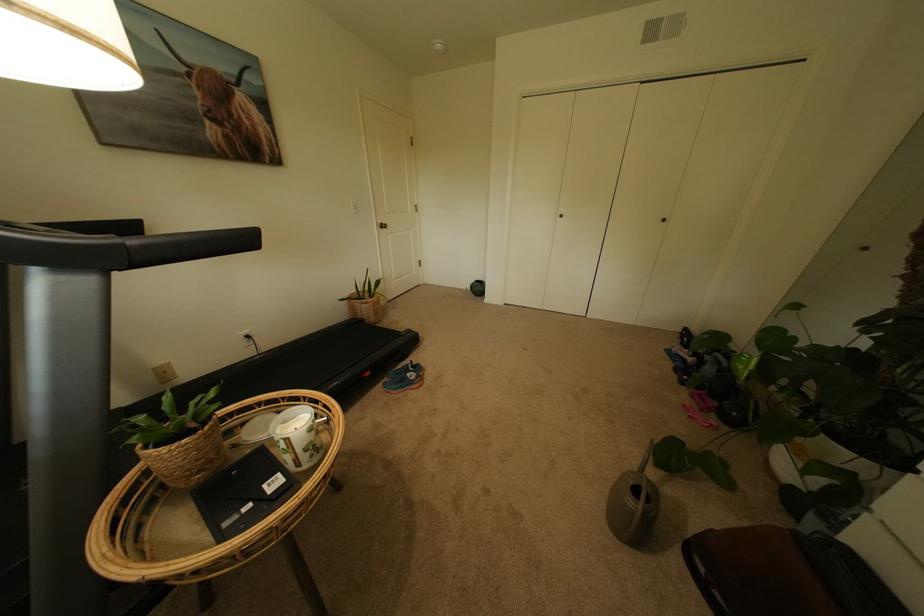
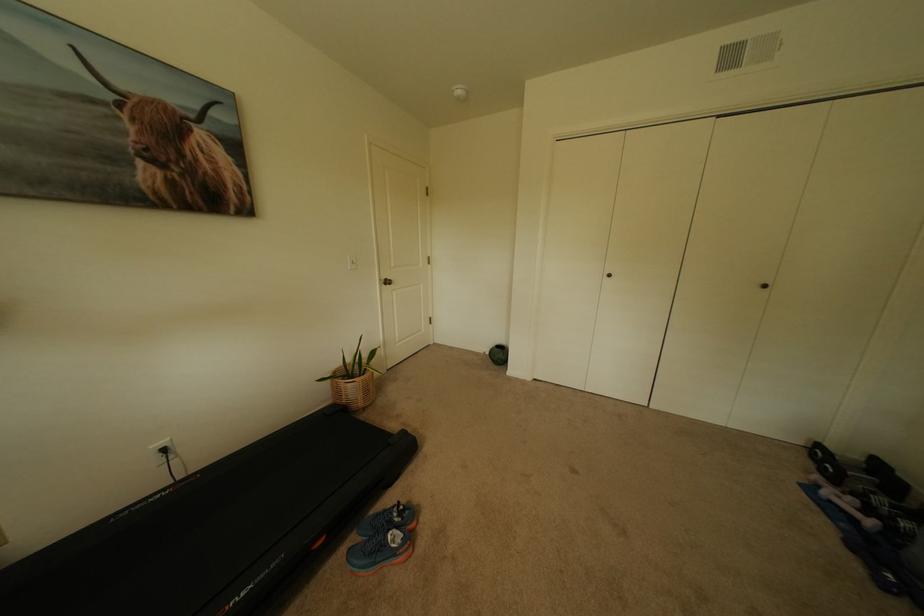
Find the pixel in the second image that matches (x=693, y=333) in the first image.

(827, 452)